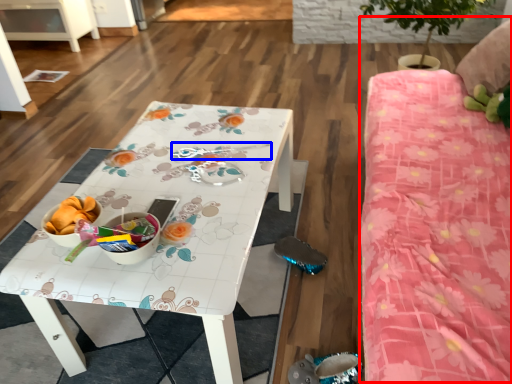
Question: Among these objects, which one is farthest to the camera, bed (highlighted by a red box) or twin (highlighted by a blue box)?

Choices:
 (A) bed
 (B) twin

Answer: (B)